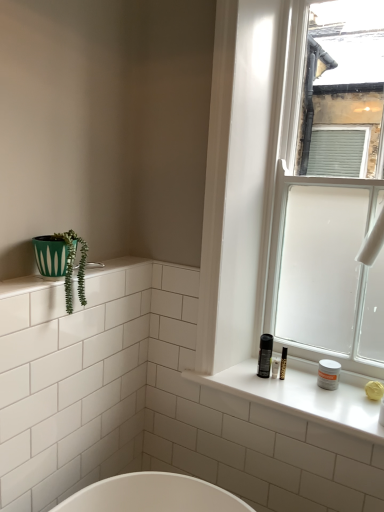
Image resolution: width=384 pixels, height=512 pixels. I want to click on free space in front of white glass window at right, so click(x=328, y=392).